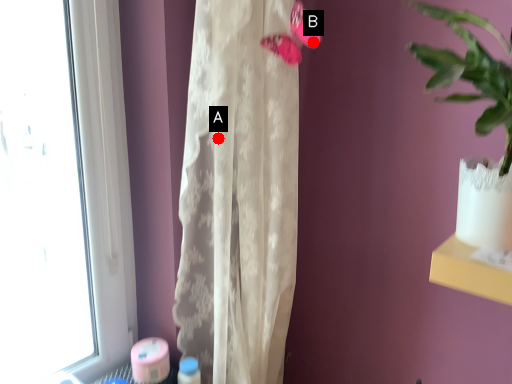
Question: Two points are circled on the image, labeled by A and B beside each circle. Which point is closer to the camera taking this photo?

Choices:
 (A) A is closer
 (B) B is closer

Answer: (B)